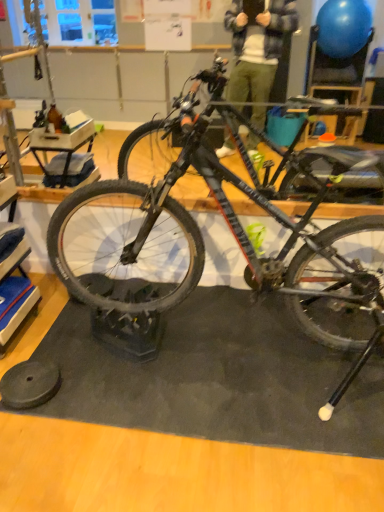
Question: Is shiny black tire at center outside of matte black bicycle at center?

Choices:
 (A) yes
 (B) no

Answer: (B)

Question: From the image's perspective, would you say shiny black tire at center is positioned over matte black bicycle at center?

Choices:
 (A) yes
 (B) no

Answer: (B)

Question: From a real-world perspective, is shiny black tire at center beneath matte black bicycle at center?

Choices:
 (A) yes
 (B) no

Answer: (A)

Question: Is shiny black tire at center bigger than matte black bicycle at center?

Choices:
 (A) no
 (B) yes

Answer: (A)

Question: Are shiny black tire at center and matte black bicycle at center far apart?

Choices:
 (A) no
 (B) yes

Answer: (A)

Question: Would you say matte black bicycle at center is part of shiny black tire at center's contents?

Choices:
 (A) no
 (B) yes

Answer: (A)

Question: Can we say matte black bicycle at center lies outside black rubber wheel at lower left?

Choices:
 (A) yes
 (B) no

Answer: (A)

Question: Considering the relative sizes of matte black bicycle at center and black rubber wheel at lower left in the image provided, is matte black bicycle at center shorter than black rubber wheel at lower left?

Choices:
 (A) yes
 (B) no

Answer: (B)

Question: Is matte black bicycle at center thinner than black rubber wheel at lower left?

Choices:
 (A) no
 (B) yes

Answer: (A)

Question: Considering the relative sizes of matte black bicycle at center and black rubber wheel at lower left in the image provided, is matte black bicycle at center taller than black rubber wheel at lower left?

Choices:
 (A) no
 (B) yes

Answer: (B)

Question: From a real-world perspective, is matte black bicycle at center on top of black rubber wheel at lower left?

Choices:
 (A) yes
 (B) no

Answer: (A)

Question: Can you confirm if matte black bicycle at center is wider than black rubber wheel at lower left?

Choices:
 (A) yes
 (B) no

Answer: (A)

Question: Is shiny black tire at center shorter than black rubber wheel at lower left?

Choices:
 (A) yes
 (B) no

Answer: (B)